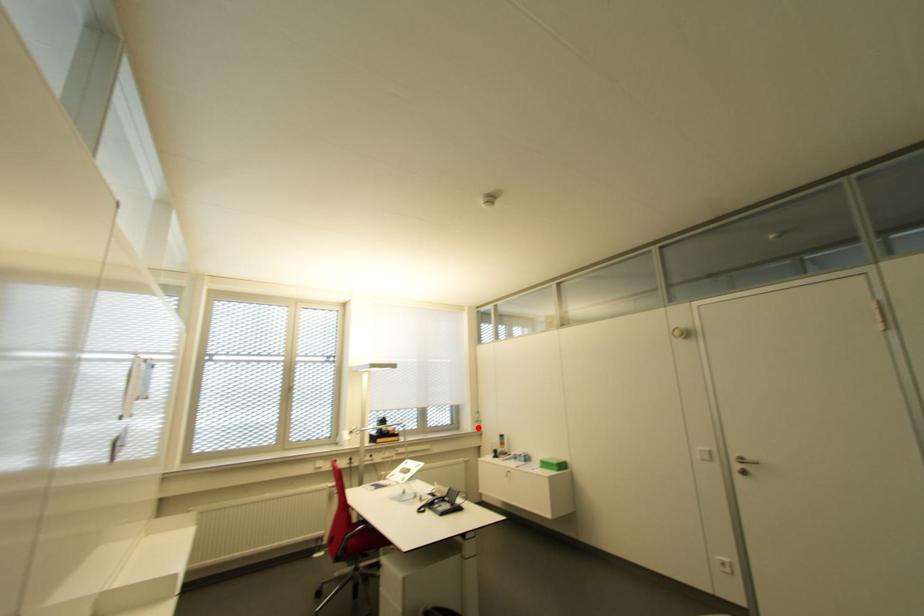
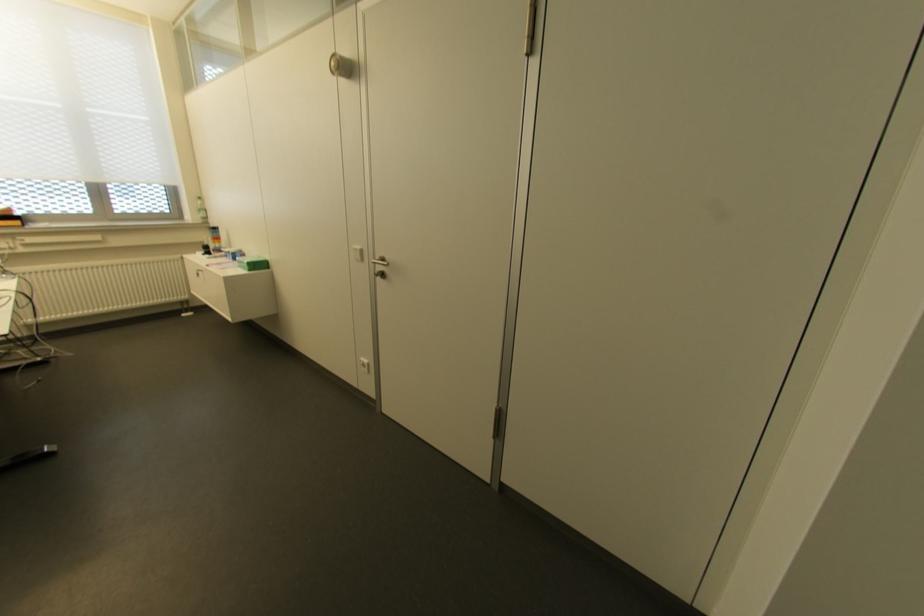
Question: I am providing you with two images of the same scene from different viewpoints. Image1 has a red point marked. In image2, the corresponding 3D location appears at what relative position? Reply with the corresponding letter.

Choices:
 (A) Closer
 (B) Farther

Answer: (A)